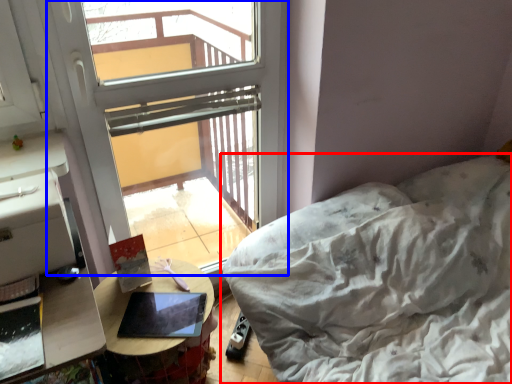
Question: Among these objects, which one is nearest to the camera, furniture (highlighted by a red box) or window (highlighted by a blue box)?

Choices:
 (A) furniture
 (B) window

Answer: (A)